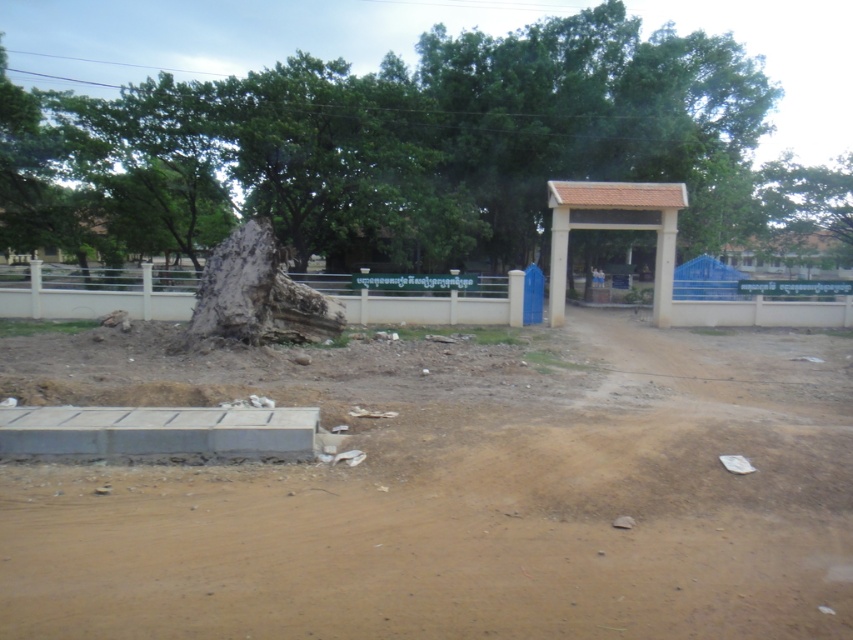
You are standing at the point marked as point (451,492) in the image. What surface are you currently standing on?

You are standing on brown sandy dirt at lower left.

You are a gardener who needs to plant a new tree in the school compound. You have a sapling that requires at least 30 meters of space between it and any existing trees to grow properly. Given the current layout, can you plant the sapling between the brown sandy dirt at lower left and the green leafy tree at center?

The distance between the brown sandy dirt at lower left and the green leafy tree at center is 27.76 meters, which is less than the required 30 meters. Therefore, planting the sapling there would not meet the space requirement.